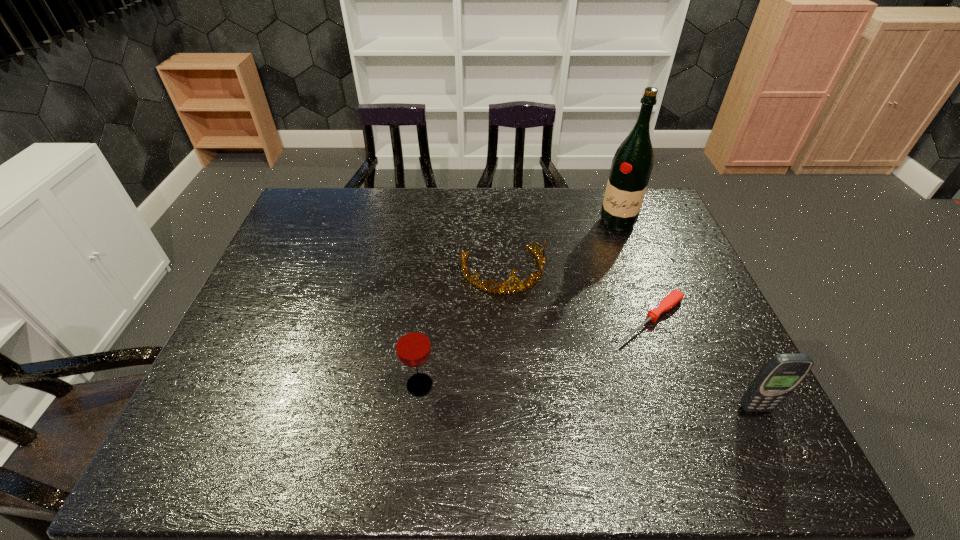
Locate an element on the screen. Image resolution: width=960 pixels, height=540 pixels. free space located on the front-facing side of the liquor is located at coordinates (605, 267).

Where is `free space located 0.200m on the front-facing side of the liquor`? free space located 0.200m on the front-facing side of the liquor is located at coordinates (604, 272).

In order to click on vacant area located 0.090m on the front-facing side of the liquor in this screenshot , I will do `click(610, 249)`.

Locate an element on the screen. free space located 0.160m at the tip of the screwdriver is located at coordinates (586, 369).

You are a GUI agent. You are given a task and a screenshot of the screen. Output one action in this format:
    pyautogui.click(x=<x>, y=<y>)
    Task: Click on the vacant space located at the tip of the screwdriver
    
    Given the screenshot: What is the action you would take?
    pyautogui.click(x=597, y=360)

At what (x,y) coordinates should I click in order to perform the action: click on vacant space located 0.190m at the tip of the screwdriver. Please return your answer as a coordinate pair (x, y). Looking at the image, I should click on (578, 376).

You are a GUI agent. You are given a task and a screenshot of the screen. Output one action in this format:
    pyautogui.click(x=<x>, y=<y>)
    Task: Click on the free space located on the front-facing side of the fourth tallest object
    The height and width of the screenshot is (540, 960).
    Given the screenshot: What is the action you would take?
    pyautogui.click(x=519, y=322)

In order to click on free space located on the front-facing side of the fourth tallest object in this screenshot , I will do `click(530, 355)`.

Locate an element on the screen. This screenshot has height=540, width=960. vacant area situated on the front-facing side of the fourth tallest object is located at coordinates (518, 319).

What are the coordinates of `object at the far edge` in the screenshot? It's located at (631, 167).